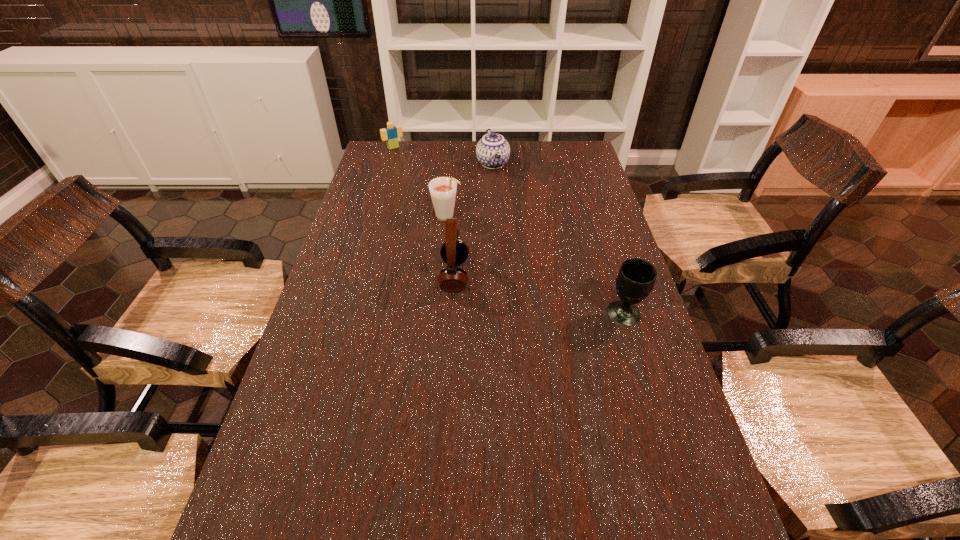
Where is `free point located on the ear pads of the second nearest object`? The height and width of the screenshot is (540, 960). free point located on the ear pads of the second nearest object is located at coordinates (409, 276).

The width and height of the screenshot is (960, 540). I want to click on free point located 0.090m on the front of the nearest object, so click(636, 356).

Image resolution: width=960 pixels, height=540 pixels. I want to click on vacant region located at the spout of the chinaware, so click(509, 208).

The width and height of the screenshot is (960, 540). In order to click on free space located 0.090m at the spout of the chinaware in this screenshot , I will do coord(502,191).

At what (x,y) coordinates should I click in order to perform the action: click on free space located 0.160m at the spout of the chinaware. Please return your answer as a coordinate pair (x, y). The image size is (960, 540). Looking at the image, I should click on (506, 201).

This screenshot has height=540, width=960. Find the location of `vacant region located 0.070m on the drink side of the root beer`. vacant region located 0.070m on the drink side of the root beer is located at coordinates (468, 235).

Locate an element on the screen. blank area located 0.330m on the drink side of the root beer is located at coordinates (521, 279).

The image size is (960, 540). I want to click on free region located on the drink side of the root beer, so click(493, 256).

Find the location of a particular element. vacant region located on the face of the Lego is located at coordinates (416, 170).

At what (x,y) coordinates should I click in order to perform the action: click on blank space located 0.240m on the face of the Lego. Please return your answer as a coordinate pair (x, y). The image size is (960, 540). Looking at the image, I should click on (422, 177).